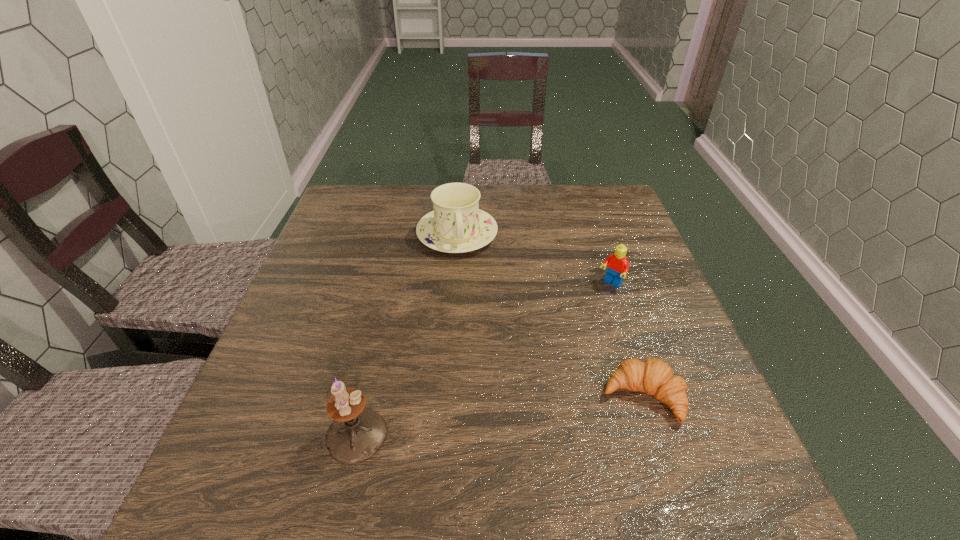
Where is `vacant space at the left edge of the desktop`? Image resolution: width=960 pixels, height=540 pixels. vacant space at the left edge of the desktop is located at coordinates (302, 352).

At what (x,y) coordinates should I click in order to perform the action: click on vacant space at the right edge of the desktop. Please return your answer as a coordinate pair (x, y). This screenshot has width=960, height=540. Looking at the image, I should click on (640, 265).

This screenshot has width=960, height=540. Find the location of `free location at the far left corner`. free location at the far left corner is located at coordinates (370, 195).

Image resolution: width=960 pixels, height=540 pixels. Identify the location of vacant space at the far right corner. (571, 197).

Where is `free space at the near right corner of the desktop`? free space at the near right corner of the desktop is located at coordinates (661, 430).

Find the location of a particular element. This screenshot has width=960, height=540. free space between the crescent roll and the farthest object is located at coordinates (550, 316).

Find the location of a particular element. The width and height of the screenshot is (960, 540). vacant space in between the third nearest object and the tallest object is located at coordinates (484, 360).

Locate an element on the screen. vacant area between the third nearest object and the tallest object is located at coordinates (484, 360).

The width and height of the screenshot is (960, 540). I want to click on unoccupied area between the shortest object and the farthest object, so tap(550, 316).

The width and height of the screenshot is (960, 540). Identify the location of vacant space that is in between the second farthest object and the farthest object. (534, 259).